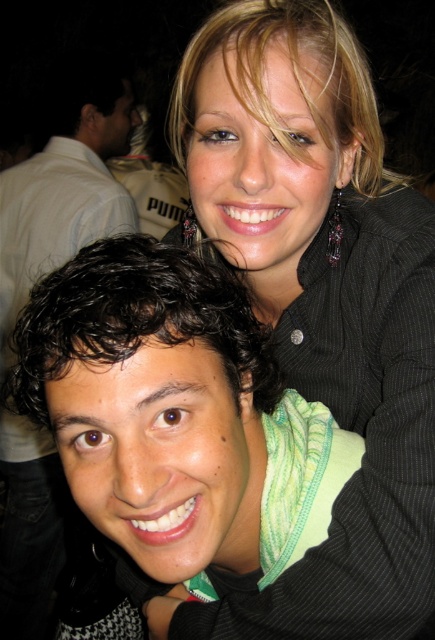
Question: Does black pinstripe jacket at upper right have a lesser width compared to dark curly hair at left?

Choices:
 (A) yes
 (B) no

Answer: (A)

Question: Which of the following is the closest to the observer?

Choices:
 (A) (191, 163)
 (B) (33, 612)

Answer: (A)

Question: Can you confirm if black pinstripe jacket at upper right is positioned to the left of dark curly hair at left?

Choices:
 (A) no
 (B) yes

Answer: (A)

Question: Which point is farther to the camera?

Choices:
 (A) (34, 467)
 (B) (380, 314)

Answer: (A)

Question: Can you confirm if black pinstripe jacket at upper right is thinner than dark curly hair at left?

Choices:
 (A) yes
 (B) no

Answer: (A)